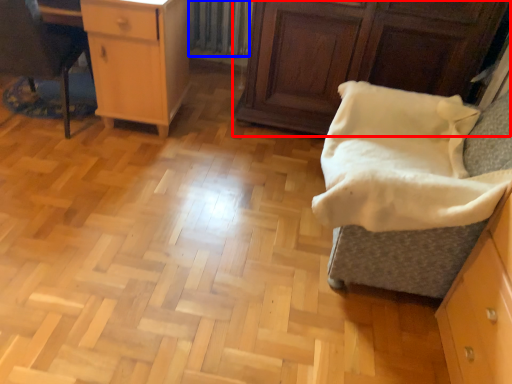
Question: Which of the following is the farthest to the observer, cabinetry (highlighted by a red box) or radiator (highlighted by a blue box)?

Choices:
 (A) cabinetry
 (B) radiator

Answer: (B)